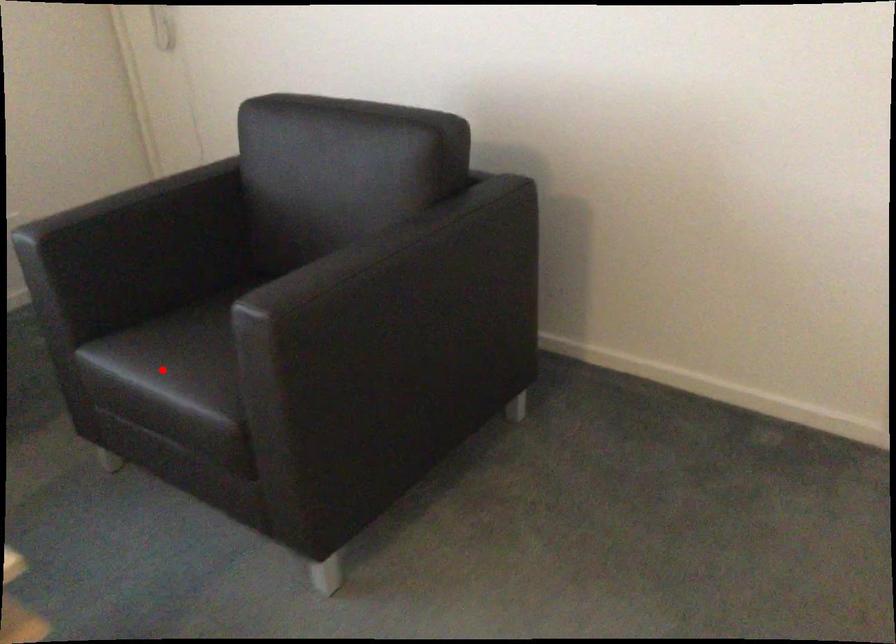
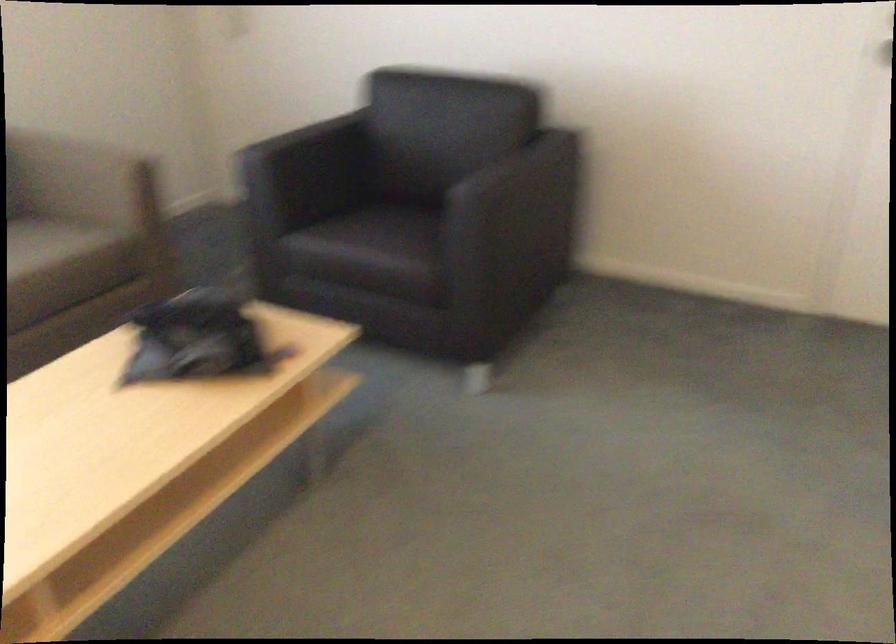
Where in the second image is the point corresponding to the highlighted location from the first image?

(368, 240)